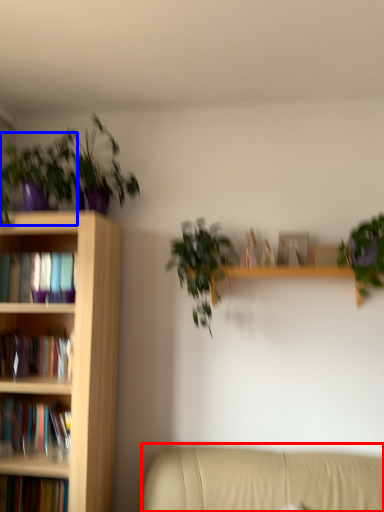
Question: Among these objects, which one is farthest to the camera, studio couch (highlighted by a red box) or houseplant (highlighted by a blue box)?

Choices:
 (A) studio couch
 (B) houseplant

Answer: (B)